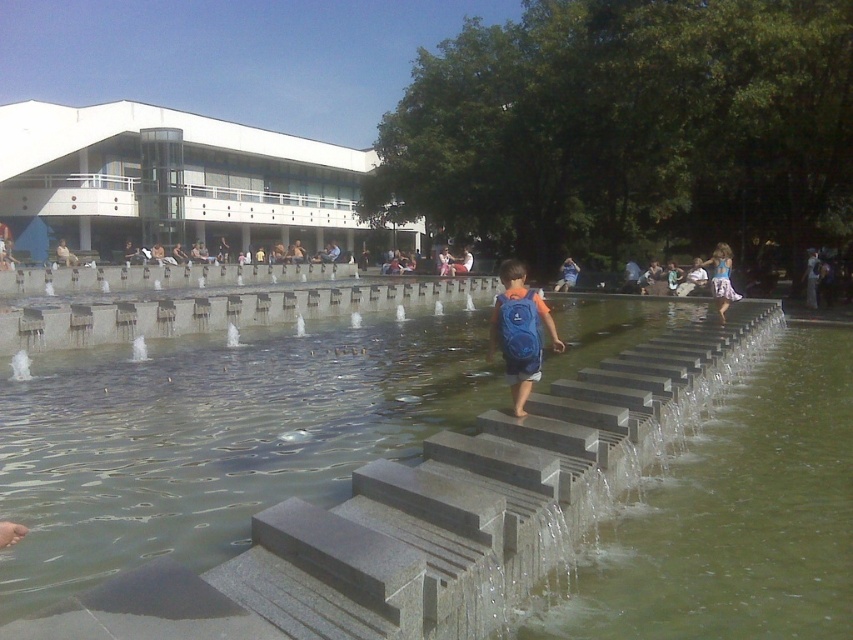
You are standing at the edge of the water feature and want to reach the greenish concrete water at center. Which direction should you move in to get there?

The greenish concrete water at center is located at point (x=717, y=512), so you should move towards the center of the water feature to reach it.

You are standing at the edge of the water feature and want to reach the greenish concrete water at center. Which direction should you move to get there?

The greenish concrete water at center is located at point [717,512], so you should move towards the center of the water feature to reach it.

You are a parent watching your child play near the water feature. You see the greenish concrete water at center and the blue fabric backpack at center. How far apart are these two items?

The greenish concrete water at center and the blue fabric backpack at center are 4.24 meters apart.